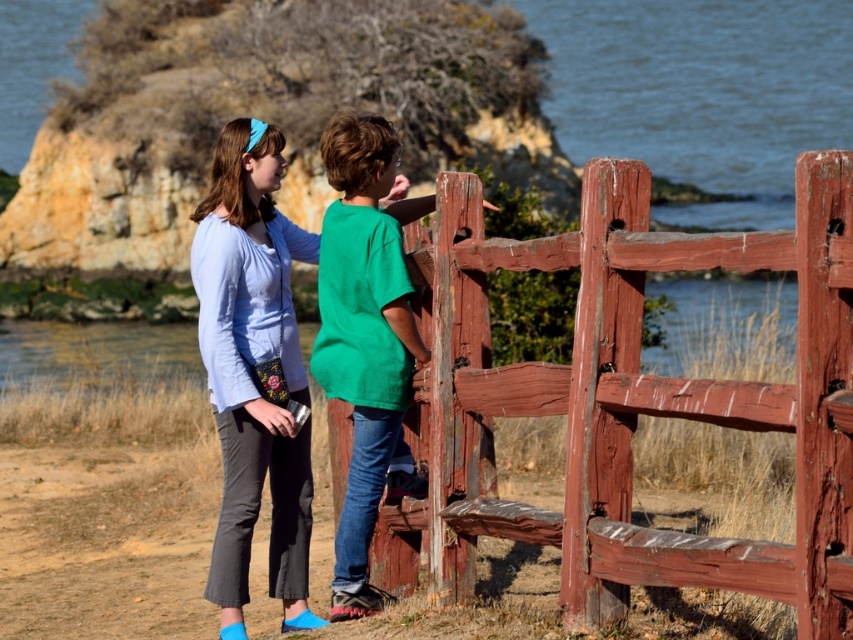
Question: Among these objects, which one is nearest to the camera?

Choices:
 (A) green matte shirt at center
 (B) smooth water at upper center
 (C) matte blue shirt at center

Answer: (B)

Question: Is smooth water at upper center bigger than green matte shirt at center?

Choices:
 (A) no
 (B) yes

Answer: (B)

Question: Which point is closer to the camera?

Choices:
 (A) (281, 145)
 (B) (641, 182)
 (C) (329, 125)
 (D) (682, 72)

Answer: (B)

Question: Which is nearer to the rustic wooden fence at center?

Choices:
 (A) smooth water at upper center
 (B) matte blue shirt at center
 (C) green matte shirt at center

Answer: (C)

Question: From the image, what is the correct spatial relationship of rustic wooden fence at center in relation to green matte shirt at center?

Choices:
 (A) below
 (B) above

Answer: (A)

Question: Is rustic wooden fence at center bigger than green matte shirt at center?

Choices:
 (A) no
 (B) yes

Answer: (B)